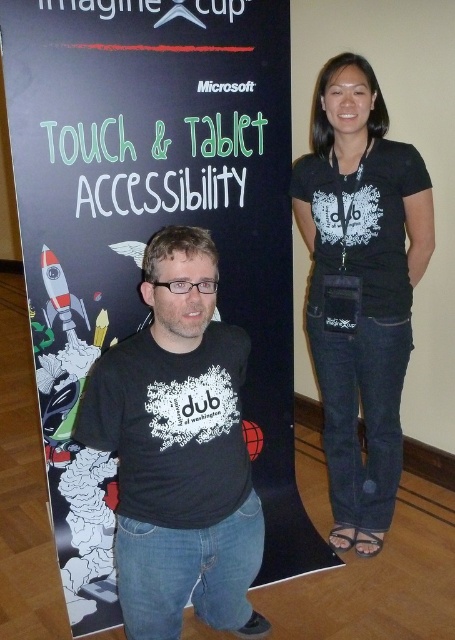
Question: Does black matte t-shirt at center appear on the right side of black matte shirt at center?

Choices:
 (A) yes
 (B) no

Answer: (B)

Question: Does black matte t-shirt at center appear under black matte shirt at center?

Choices:
 (A) yes
 (B) no

Answer: (A)

Question: Does black matte t-shirt at center have a greater width compared to black matte shirt at center?

Choices:
 (A) no
 (B) yes

Answer: (B)